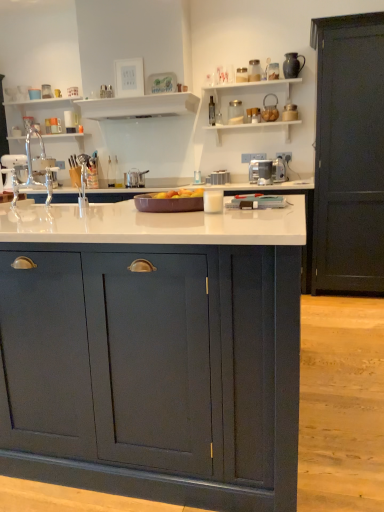
Question: Is point (44, 99) closer or farther from the camera than point (119, 112)?

Choices:
 (A) closer
 (B) farther

Answer: (B)

Question: Visually, is white glossy shelves at upper left, which is the first shelf in left-to-right order, positioned to the left or to the right of white glossy shelf at upper center, which is counted as the 1th shelf, starting from the right?

Choices:
 (A) right
 (B) left

Answer: (B)

Question: Which object is positioned closest to the dark wood door at right, which is counted as the 1th cabinetry, starting from the right?

Choices:
 (A) transparent glass bottle at upper center
 (B) metallic silver toaster at center, positioned as the 3th appliance in front-to-back order
 (C) satin silver toaster at center, the 1th appliance positioned from the front
 (D) matte dark blue cabinet at center, the first cabinetry when ordered from front to back
 (E) white glossy shelf at upper center, which is counted as the 1th shelf, starting from the right

Answer: (C)

Question: Estimate the real-world distances between objects in this image. Which object is farther from the matte dark blue cabinet at center, the 2th cabinetry when ordered from back to front?

Choices:
 (A) white glossy shelves at upper left, which is the second shelf from right to left
 (B) dark wood door at right, which appears as the first cabinetry when viewed from the back
 (C) satin silver pot at center, arranged as the second appliance when viewed from the back
 (D) satin silver toaster at center, marked as the third appliance in a left-to-right arrangement
 (E) transparent glass bottle at upper center

Answer: (A)